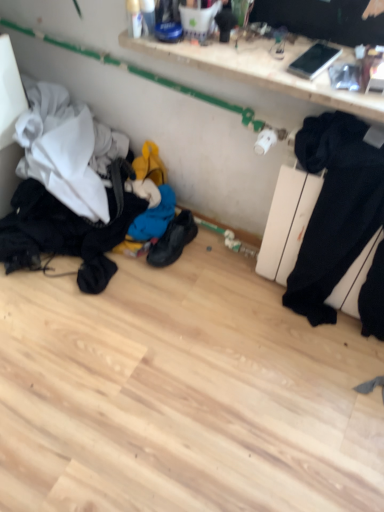
I want to click on free area in between black leather shoes at center and black fabric laundry at lower left, so click(143, 291).